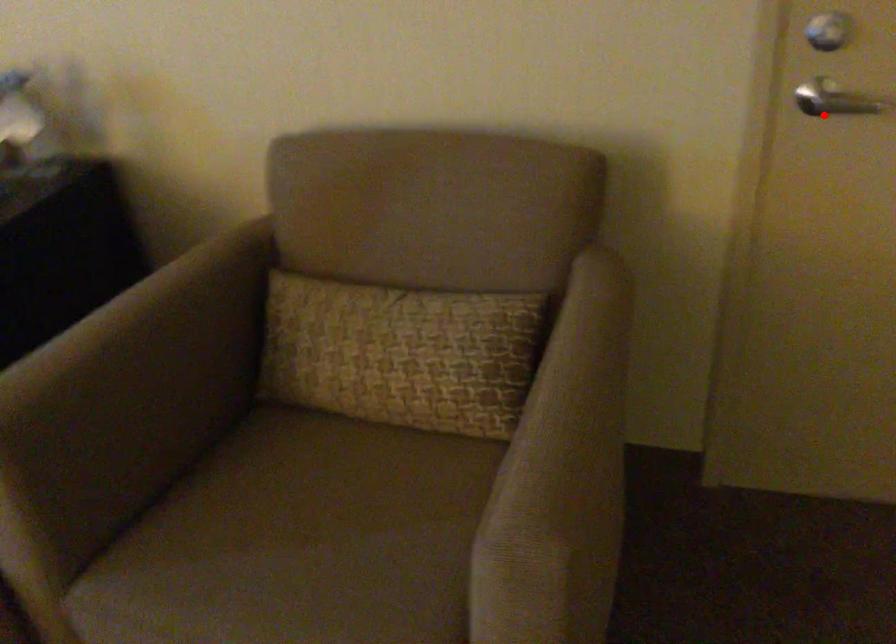
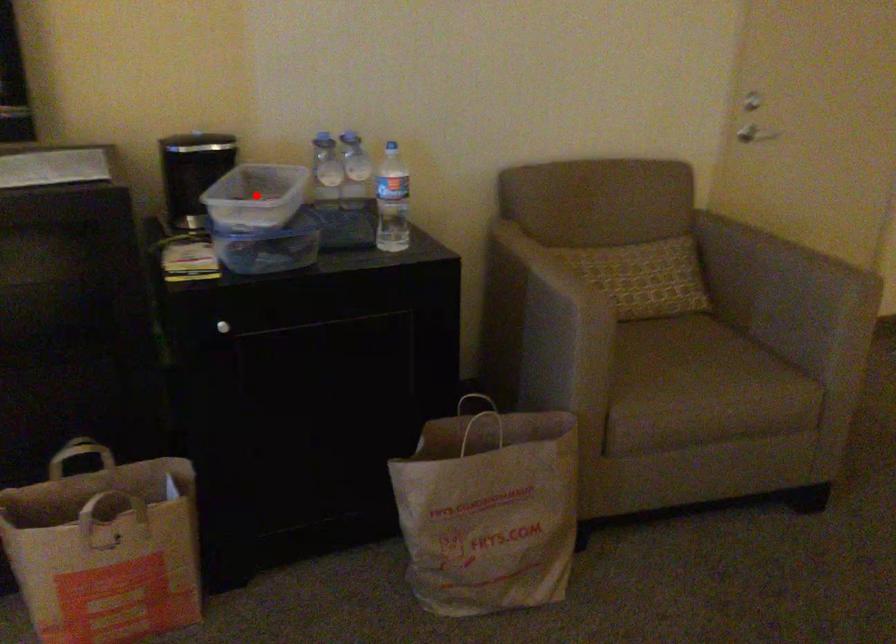
I am providing you with two images of the same scene from different viewpoints. A red point is marked on the first image and another point is marked on the second image. Is the red point in image1 aligned with the point shown in image2?

No